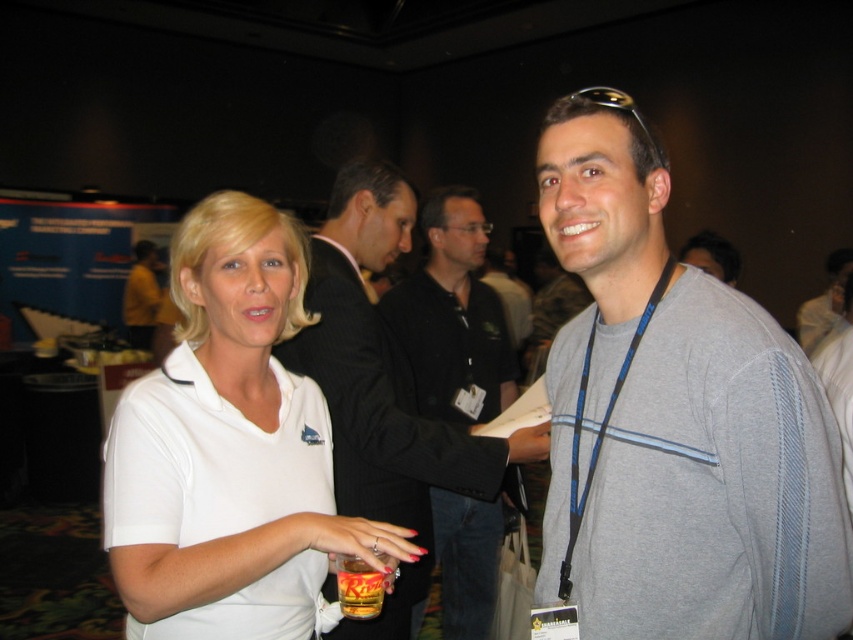
Question: Is gray fabric shirt at center positioned before white matte shirt at center?

Choices:
 (A) no
 (B) yes

Answer: (B)

Question: Is matte black suit at center bigger than golden amber glass at lower center?

Choices:
 (A) yes
 (B) no

Answer: (A)

Question: Which object appears closest to the camera in this image?

Choices:
 (A) white matte shirt at center
 (B) matte black suit at center
 (C) golden amber glass at lower center
 (D) gray fabric shirt at center

Answer: (D)

Question: Which point is farther to the camera?

Choices:
 (A) matte black suit at center
 (B) white matte shirt at center
 (C) golden amber glass at lower center

Answer: (A)

Question: Which object appears closest to the camera in this image?

Choices:
 (A) gray fabric shirt at center
 (B) white matte shirt at center
 (C) golden amber glass at lower center
 (D) matte black suit at center

Answer: (A)

Question: Can you confirm if white matte shirt at center is wider than matte black suit at center?

Choices:
 (A) no
 (B) yes

Answer: (A)